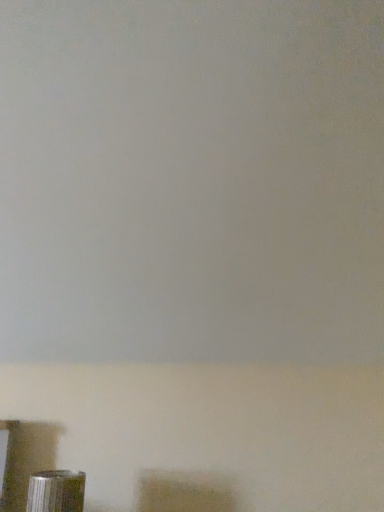
Measure the distance between shiny metallic can at bottom left and camera.

They are 3.92 feet apart.

What is the approximate height of shiny metallic can at bottom left?

shiny metallic can at bottom left is 5.59 inches tall.

The image size is (384, 512). In order to click on shiny metallic can at bottom left in this screenshot , I will do `click(56, 490)`.

Describe the element at coordinates (56, 490) in the screenshot. The image size is (384, 512). I see `shiny metallic can at bottom left` at that location.

Identify the location of shiny metallic can at bottom left. The image size is (384, 512). (56, 490).